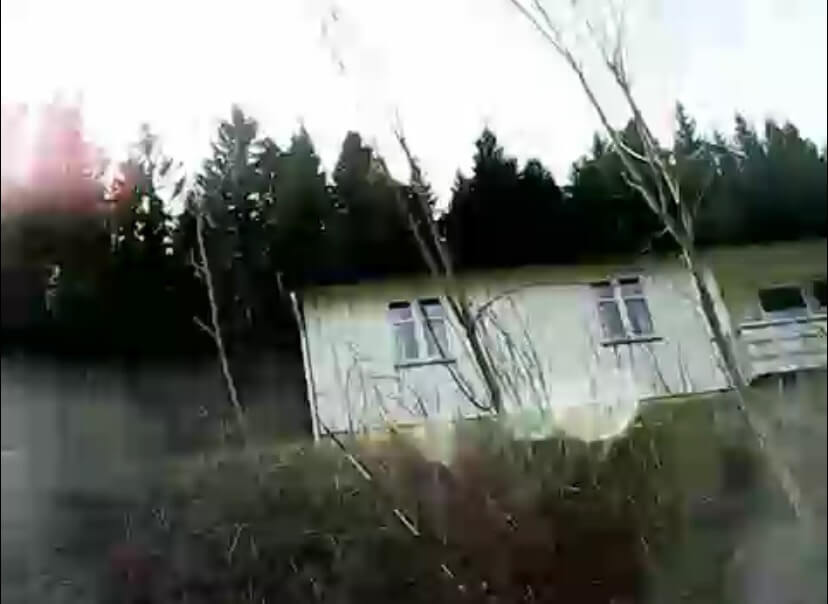
Locate an element on the screen. The height and width of the screenshot is (604, 828). window pane is located at coordinates (406, 339), (437, 330), (436, 309), (403, 313), (617, 325), (637, 320), (633, 286), (608, 294), (774, 298), (820, 291).